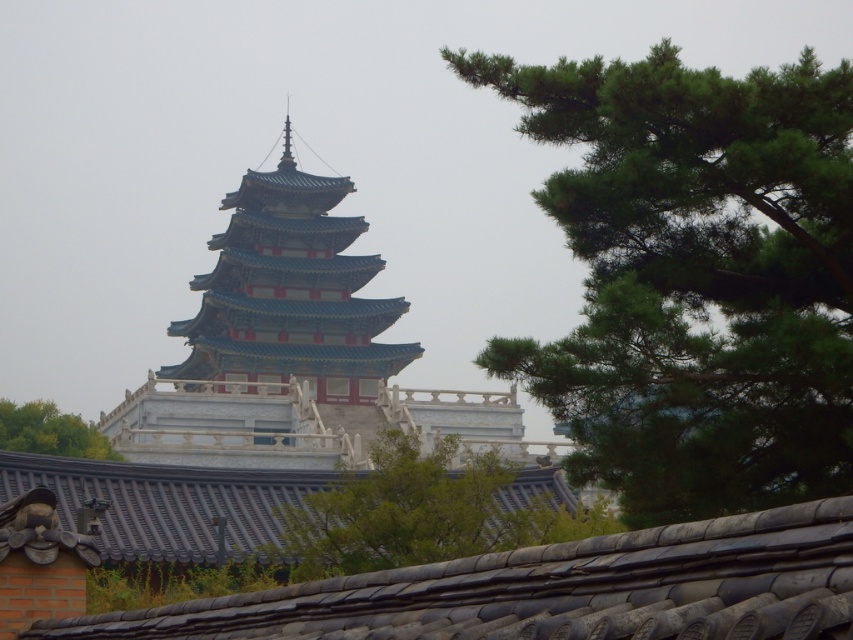
Can you confirm if gray tile roof at lower center is taller than shiny dark gray tiles at center?

Yes.

Is point (817, 609) behind point (223, 472)?

No, (817, 609) is closer to viewer.

At what (x,y) coordinates should I click in order to perform the action: click on gray tile roof at lower center. Please return your answer as a coordinate pair (x, y). This screenshot has width=853, height=640. Looking at the image, I should click on (x=554, y=589).

What do you see at coordinates (421, 513) in the screenshot? I see `green leafy tree at center` at bounding box center [421, 513].

Is point (312, 493) more distant than point (115, 452)?

No, it is not.

Does point (361, 493) come behind point (33, 420)?

That is False.

Locate an element on the screen. The width and height of the screenshot is (853, 640). green leafy tree at center is located at coordinates (421, 513).

Does point (71, 524) lie in front of point (61, 416)?

Yes, point (71, 524) is closer to viewer.

Find the location of a particular element. This screenshot has height=640, width=853. shiny dark gray tiles at center is located at coordinates (166, 502).